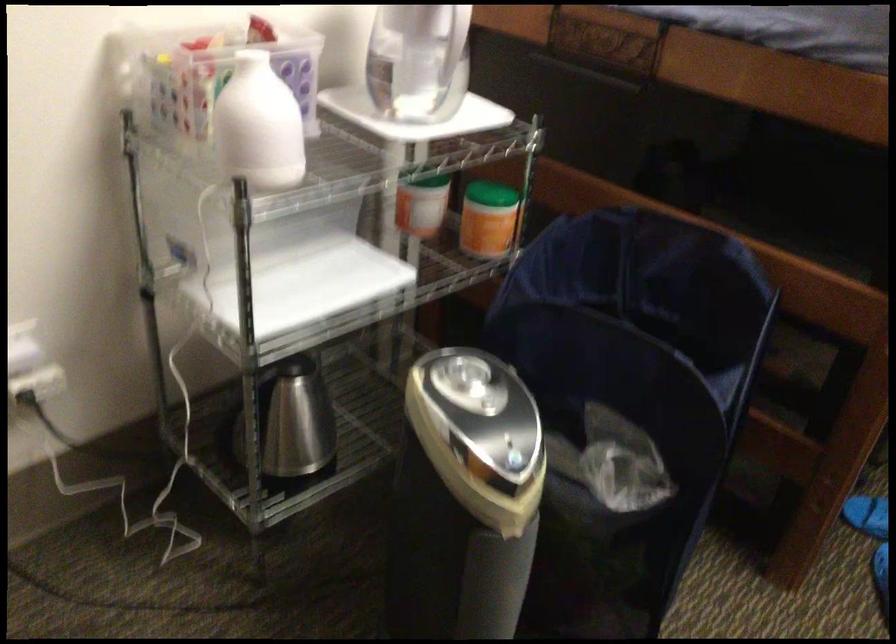
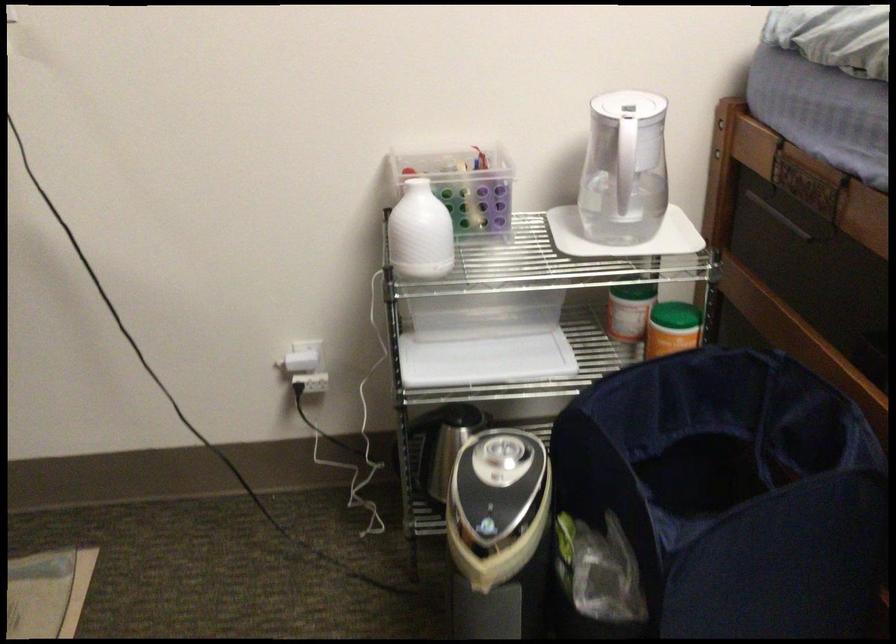
In the second image, find the point that corresponds to point 271,67 in the first image.

(463, 185)